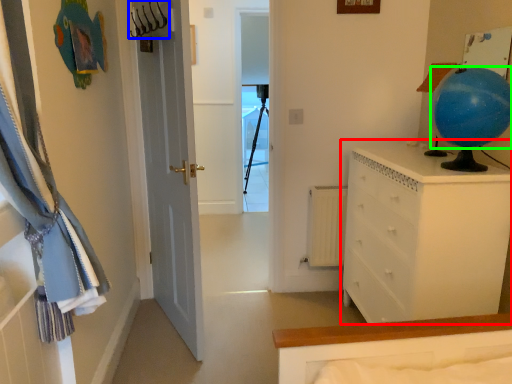
Question: Which object is the closest to the chest of drawers (highlighted by a red box)? Choose among these: hanger (highlighted by a blue box) or balloon (highlighted by a green box).

Choices:
 (A) hanger
 (B) balloon

Answer: (B)